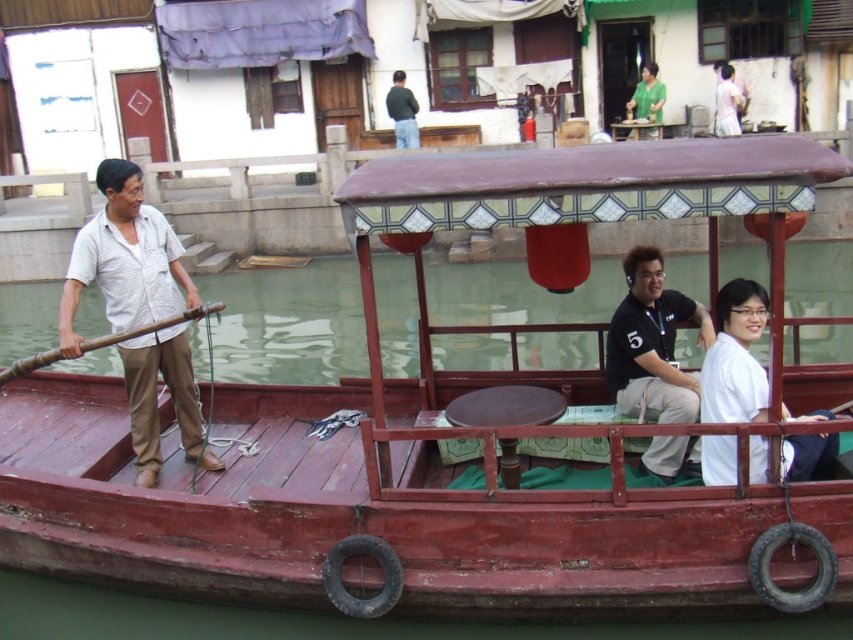
Question: Is wooden at left wider than green matte shirt at upper center?

Choices:
 (A) no
 (B) yes

Answer: (B)

Question: Which object appears farthest from the camera in this image?

Choices:
 (A) green matte shirt at upper center
 (B) wooden at left
 (C) wooden boat at center
 (D) white matte shirt at center

Answer: (A)

Question: Considering the relative positions of white matte shirt at center and green sweater at upper center in the image provided, where is white matte shirt at center located with respect to green sweater at upper center?

Choices:
 (A) left
 (B) right

Answer: (B)

Question: Which object is positioned farthest from the light brown cotton shirt at left?

Choices:
 (A) wooden boat at center
 (B) black matte shirt at center
 (C) white matte shirt at upper right

Answer: (C)

Question: Is wooden at left thinner than green sweater at upper center?

Choices:
 (A) no
 (B) yes

Answer: (A)

Question: Based on their relative distances, which object is farther from the green sweater at upper center?

Choices:
 (A) black matte shirt at center
 (B) white matte shirt at center

Answer: (B)